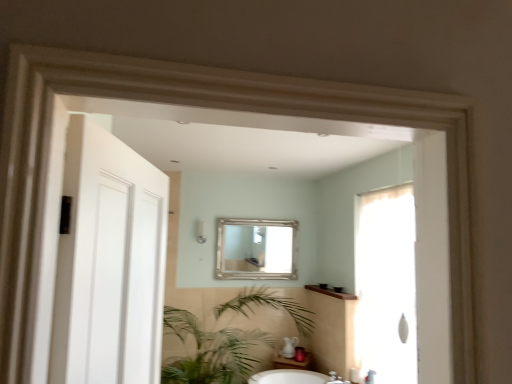
Locate an element on the screen. The height and width of the screenshot is (384, 512). blank area beneath silver metallic mirror at center (from a real-world perspective) is located at coordinates (250, 286).